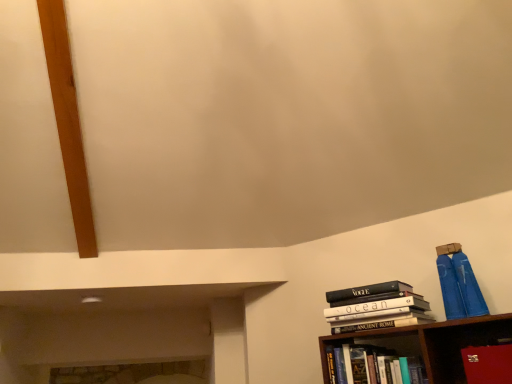
Locate an element on the screen. The width and height of the screenshot is (512, 384). empty space that is ontop of hardcover book at lower right, which is the first book in bottom-to-top order is located at coordinates (378, 337).